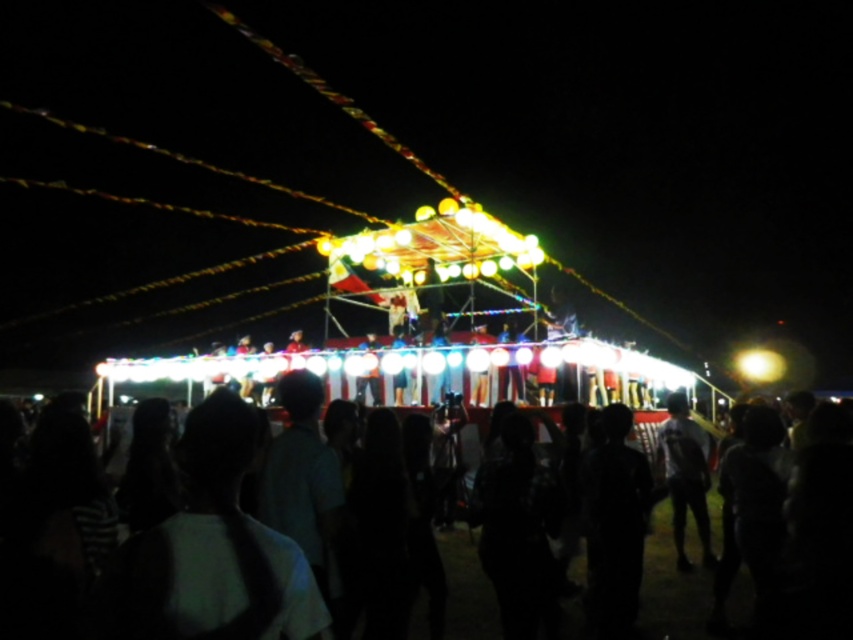
You are a photographer at the fairground. You want to capture both the black matte crowd at center and the dark gray fabric shirt at center in a single photo. Which object will appear bigger in the photo?

The black matte crowd at center will appear bigger in the photo because it is larger in size than the dark gray fabric shirt at center.

You are at the fairground and want to locate the dark gray fabric shirt at center. Which direction should you look relative to the black matte crowd at center?

The dark gray fabric shirt at center is to the right of the black matte crowd at center.

You are standing at the fairground and want to take a photo of the stage. The camera you have can focus up to 40 meters. Is the point at coordinates point (419, 620) within the camera focus range?

The distance of point (419, 620) from camera is 38.87 meters, which is within the camera focus range of up to 40 meters. Therefore, the point can be focused on by the camera.